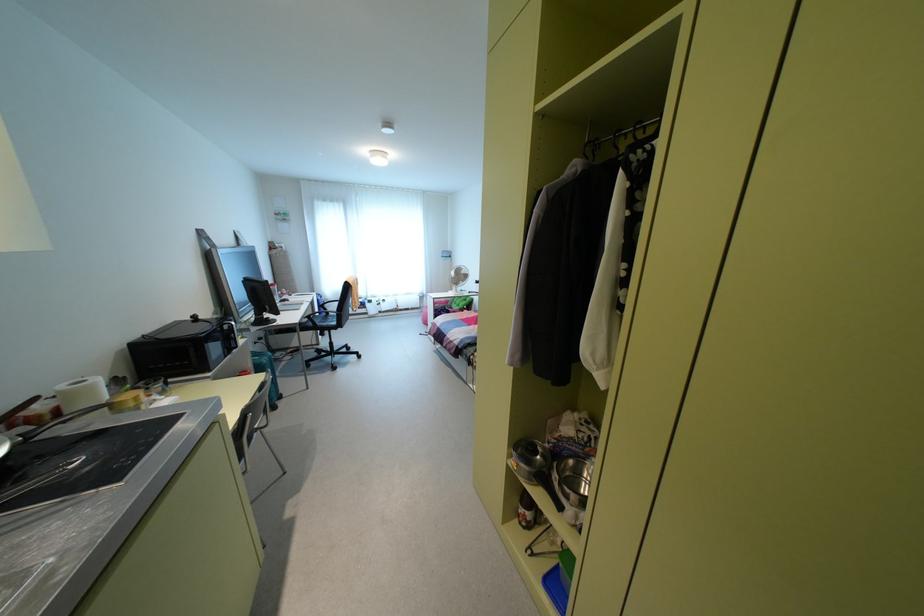
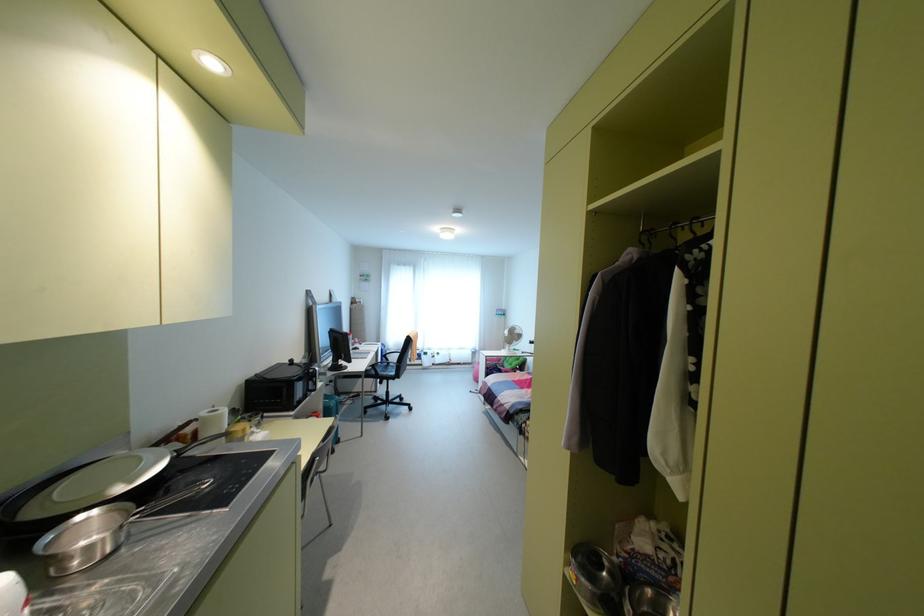
Question: Which direction would the cameraman need to move to produce the second image? Reply with the corresponding letter.

Choices:
 (A) Left
 (B) Right
 (C) Forward
 (D) Backward

Answer: (D)